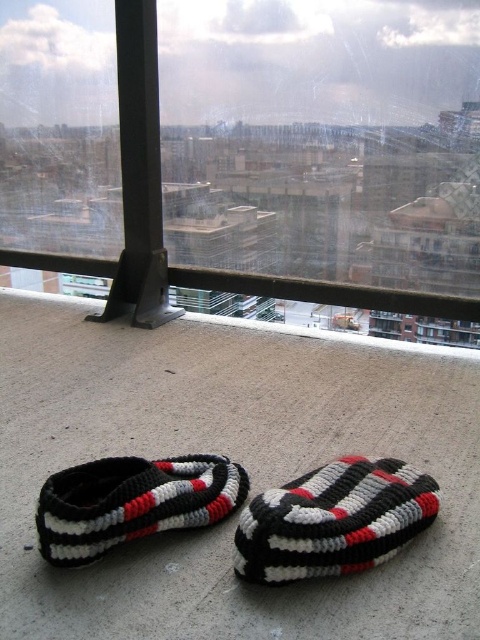
Question: Does transparent glass window at center appear on the right side of knitted woolen slipper at lower center?

Choices:
 (A) yes
 (B) no

Answer: (A)

Question: Which is nearer to the knitted woolen slipper at lower center?

Choices:
 (A) knitted fabric slipper at lower center
 (B) transparent glass window at center

Answer: (A)

Question: Is the position of transparent glass window at center more distant than that of knitted fabric slipper at lower center?

Choices:
 (A) no
 (B) yes

Answer: (B)

Question: Which of the following is the closest to the observer?

Choices:
 (A) (99, 484)
 (B) (278, 513)

Answer: (B)

Question: Can you confirm if transparent glass window at center is bigger than knitted woolen slipper at lower center?

Choices:
 (A) yes
 (B) no

Answer: (A)

Question: Among these points, which one is farthest from the camera?

Choices:
 (A) (343, 532)
 (B) (120, 490)
 (C) (227, 257)

Answer: (C)